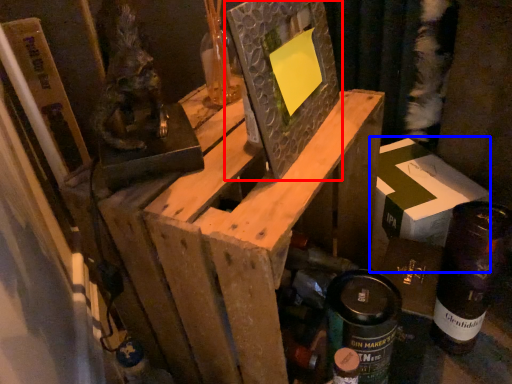
Question: Which object appears farthest to the camera in this image, picture frame (highlighted by a red box) or cardboard box (highlighted by a blue box)?

Choices:
 (A) picture frame
 (B) cardboard box

Answer: (B)